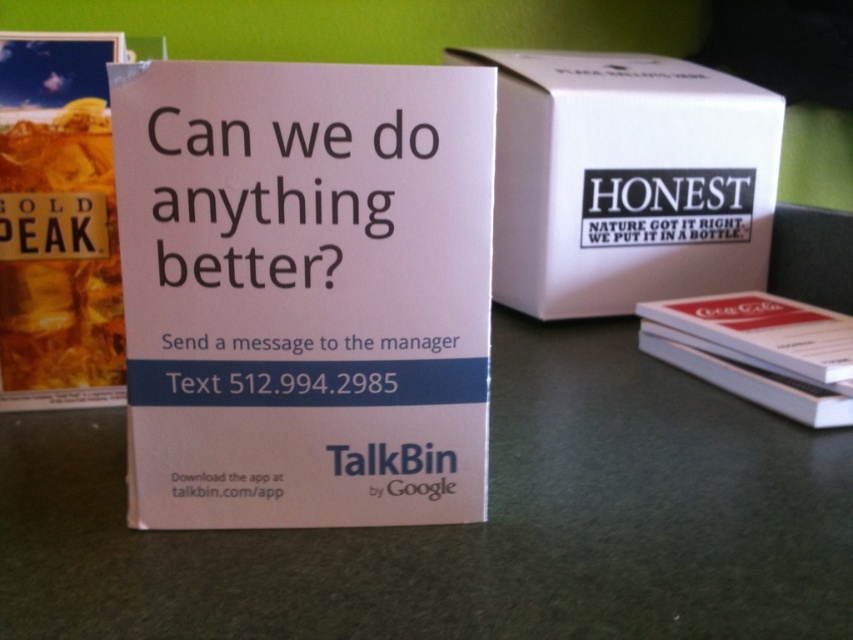
You are setting up a small booth for a product demo. You have a white paperboard at center and a gold peak liquid at left. The booth has limited space. Can you place both items side by side without overlapping?

The white paperboard at center is 10.33 inches from the gold peak liquid at left, so yes, they can be placed side by side without overlapping as there is sufficient space between them.

You are organizing items on a table and need to place the gold peak liquid at left and the white paper book at right. According to the image, which item is positioned higher up?

The gold peak liquid at left is positioned higher up than the white paper book at right.

You are organizing a small event and need to place a name tag and a menu card on a table. The name tag is placed on the white paperboard at center, and the menu card is placed on the white matte cardboard box at center. Which surface has more space left for additional items?

The white matte cardboard box at center has more space left because its width is greater than the white paperboard at center.